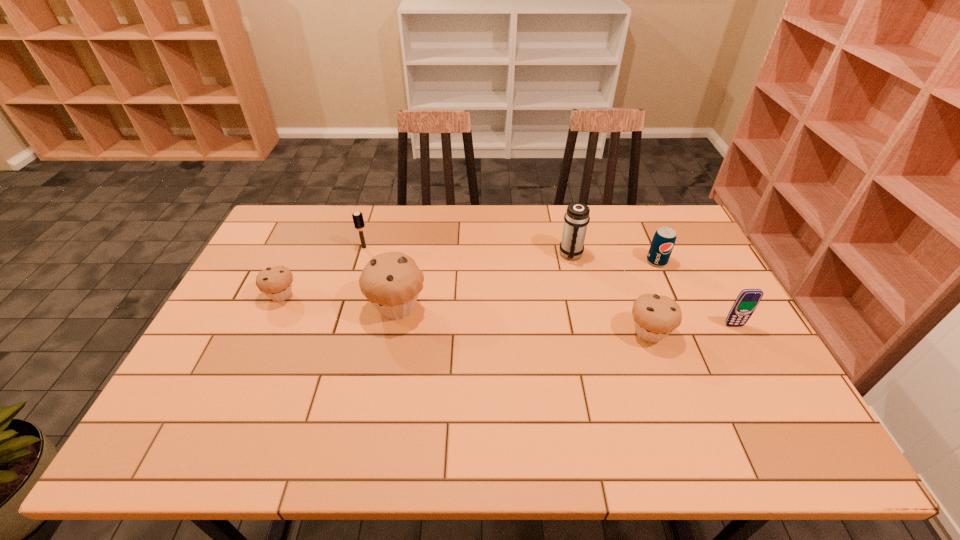
To achieve uniform spacing by inserting another muffin among them, please point to a free space for this new muffin. Please provide its 2D coordinates. Your answer should be formatted as a tuple, i.e. [(x, y)], where the tuple contains the x and y coordinates of a point satisfying the conditions above.

[(519, 320)]